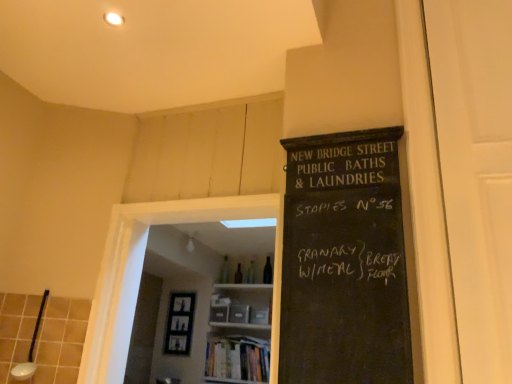
What is the approximate height of hardcover books at center?

15.09 inches.

Looking at this image, what is the approximate height of white matte door at right, marked as the 2th glass door in a left-to-right arrangement?

4.73 feet.

Where is `white matte door at right, marked as the 2th glass door in a left-to-right arrangement`? This screenshot has height=384, width=512. white matte door at right, marked as the 2th glass door in a left-to-right arrangement is located at coordinates (476, 172).

This screenshot has width=512, height=384. What do you see at coordinates (239, 334) in the screenshot? I see `wooden bookshelf at center` at bounding box center [239, 334].

Identify the location of wooden bookshelf at center. (239, 334).

Where is `white ceramic spoon at lower left`? white ceramic spoon at lower left is located at coordinates (42, 336).

Identify the location of transparent glass door at center, acting as the 1th glass door starting from the back. Image resolution: width=512 pixels, height=384 pixels. (142, 270).

Is white ceramic spoon at lower left outside of hardcover books at center?

Yes, white ceramic spoon at lower left is located beyond the bounds of hardcover books at center.

From the image's perspective, is white ceramic spoon at lower left above hardcover books at center?

Yes, from the image's perspective, white ceramic spoon at lower left is above hardcover books at center.

How far apart are white ceramic spoon at lower left and hardcover books at center?

white ceramic spoon at lower left is 5.70 feet from hardcover books at center.

Considering the sizes of objects white ceramic spoon at lower left and hardcover books at center in the image provided, who is taller, white ceramic spoon at lower left or hardcover books at center?

With more height is white ceramic spoon at lower left.

Who is shorter, white ceramic spoon at lower left or white matte door at right, which is the first glass door from front to back?

Standing shorter between the two is white ceramic spoon at lower left.

Measure the distance from white ceramic spoon at lower left to white matte door at right, which is the first glass door from front to back.

white ceramic spoon at lower left and white matte door at right, which is the first glass door from front to back, are 5.81 feet apart from each other.

Where is `tile lying behind the white matte door at right, marked as the 2th glass door in a left-to-right arrangement`? Image resolution: width=512 pixels, height=384 pixels. tile lying behind the white matte door at right, marked as the 2th glass door in a left-to-right arrangement is located at coordinates (42, 336).

Is white matte door at right, which ranks as the 1th glass door in right-to-left order, outside of transparent glass door at center, which is the 2th glass door from front to back?

Yes, white matte door at right, which ranks as the 1th glass door in right-to-left order, is not within transparent glass door at center, which is the 2th glass door from front to back.

Which object is further away from the camera taking this photo, white matte door at right, which is the first glass door from front to back, or transparent glass door at center, which is the first glass door in left-to-right order?

Positioned behind is transparent glass door at center, which is the first glass door in left-to-right order.

Is white matte door at right, which ranks as the 1th glass door in right-to-left order, with transparent glass door at center, acting as the 1th glass door starting from the back?

No.

From the image's perspective, is transparent glass door at center, which is the first glass door in left-to-right order, on top of white ceramic spoon at lower left?

Yes, from the image's perspective, transparent glass door at center, which is the first glass door in left-to-right order, is above white ceramic spoon at lower left.

The image size is (512, 384). I want to click on the 1st glass door in front of the white ceramic spoon at lower left, so click(142, 270).

Does transparent glass door at center, which is the 2th glass door from front to back, come behind white ceramic spoon at lower left?

No, the depth of transparent glass door at center, which is the 2th glass door from front to back, is less than that of white ceramic spoon at lower left.

Which object is closer to the camera, white matte door at right, marked as the 2th glass door in a left-to-right arrangement, or black chalkboard at right?

white matte door at right, marked as the 2th glass door in a left-to-right arrangement.

Is white matte door at right, the second glass door in the back-to-front sequence, bigger than black chalkboard at right?

No.

Between point (460, 160) and point (330, 285), which one is positioned behind?

Positioned behind is point (460, 160).

How distant is white matte door at right, the second glass door in the back-to-front sequence, from black chalkboard at right?

They are 12.95 inches apart.

Is black chalkboard at right oriented towards hardcover books at center?

No, black chalkboard at right is not oriented towards hardcover books at center.

Considering the sizes of objects black chalkboard at right and hardcover books at center in the image provided, who is bigger, black chalkboard at right or hardcover books at center?

Bigger between the two is hardcover books at center.

From a real-world perspective, which is physically above, black chalkboard at right or hardcover books at center?

In real-world perspective, black chalkboard at right is above.

Find the location of `bulletin board to the right of hardcover books at center`. bulletin board to the right of hardcover books at center is located at coordinates (344, 262).

Considering the sizes of hardcover books at center and wooden bookshelf at center in the image, is hardcover books at center taller or shorter than wooden bookshelf at center?

Considering their sizes, hardcover books at center has less height than wooden bookshelf at center.

From the image's perspective, between hardcover books at center and wooden bookshelf at center, which one is located above?

wooden bookshelf at center is shown above in the image.

Is hardcover books at center next to wooden bookshelf at center and touching it?

Yes, hardcover books at center is with wooden bookshelf at center.

Where is `book on the right side of white ceramic spoon at lower left`? Image resolution: width=512 pixels, height=384 pixels. book on the right side of white ceramic spoon at lower left is located at coordinates (238, 359).

This screenshot has width=512, height=384. I want to click on tile behind the white matte door at right, marked as the 2th glass door in a left-to-right arrangement, so click(x=42, y=336).

Which object lies nearer to the anchor point wooden bookshelf at center, white ceramic spoon at lower left or white matte door at right, marked as the 2th glass door in a left-to-right arrangement?

Among the two, white ceramic spoon at lower left is located nearer to wooden bookshelf at center.

Estimate the real-world distances between objects in this image. Which object is closer to white matte door at right, which ranks as the 1th glass door in right-to-left order, black chalkboard at right or wooden bookshelf at center?

Based on the image, black chalkboard at right appears to be nearer to white matte door at right, which ranks as the 1th glass door in right-to-left order.

Which object lies nearer to the anchor point transparent glass door at center, the 2th glass door viewed from the right, wooden bookshelf at center or black chalkboard at right?

Among the two, black chalkboard at right is located nearer to transparent glass door at center, the 2th glass door viewed from the right.

Considering their positions, is transparent glass door at center, which is the first glass door in left-to-right order, positioned further to white ceramic spoon at lower left than wooden bookshelf at center?

Based on the image, wooden bookshelf at center appears to be further to white ceramic spoon at lower left.

From the image, which object appears to be farther from hardcover books at center, transparent glass door at center, the 2th glass door viewed from the right, or white ceramic spoon at lower left?

white ceramic spoon at lower left is further to hardcover books at center.

When comparing their distances from white matte door at right, marked as the 2th glass door in a left-to-right arrangement, does transparent glass door at center, acting as the 1th glass door starting from the back, or wooden bookshelf at center seem closer?

The object closer to white matte door at right, marked as the 2th glass door in a left-to-right arrangement, is transparent glass door at center, acting as the 1th glass door starting from the back.

Estimate the real-world distances between objects in this image. Which object is further from white ceramic spoon at lower left, hardcover books at center or wooden bookshelf at center?

Based on the image, hardcover books at center appears to be further to white ceramic spoon at lower left.

Considering their positions, is white ceramic spoon at lower left positioned closer to transparent glass door at center, which is the first glass door in left-to-right order, than white matte door at right, the second glass door in the back-to-front sequence?

Based on the image, white ceramic spoon at lower left appears to be nearer to transparent glass door at center, which is the first glass door in left-to-right order.

At what (x,y) coordinates should I click in order to perform the action: click on bulletin board located between white matte door at right, which ranks as the 1th glass door in right-to-left order, and wooden bookshelf at center in the depth direction. Please return your answer as a coordinate pair (x, y). Looking at the image, I should click on point(344,262).

At what (x,y) coordinates should I click in order to perform the action: click on bulletin board between white matte door at right, which is the first glass door from front to back, and hardcover books at center from front to back. Please return your answer as a coordinate pair (x, y). Looking at the image, I should click on (344, 262).

This screenshot has width=512, height=384. I want to click on book positioned between black chalkboard at right and wooden bookshelf at center from near to far, so click(238, 359).

Where is `bulletin board situated between transparent glass door at center, the 2th glass door viewed from the right, and white matte door at right, which ranks as the 1th glass door in right-to-left order, from left to right`? bulletin board situated between transparent glass door at center, the 2th glass door viewed from the right, and white matte door at right, which ranks as the 1th glass door in right-to-left order, from left to right is located at coordinates (344, 262).